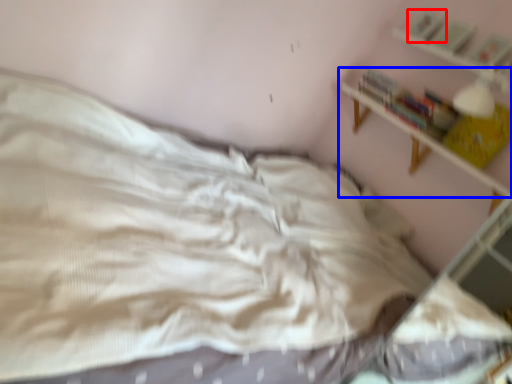
Question: Among these objects, which one is farthest to the camera, book (highlighted by a red box) or shelf (highlighted by a blue box)?

Choices:
 (A) book
 (B) shelf

Answer: (A)